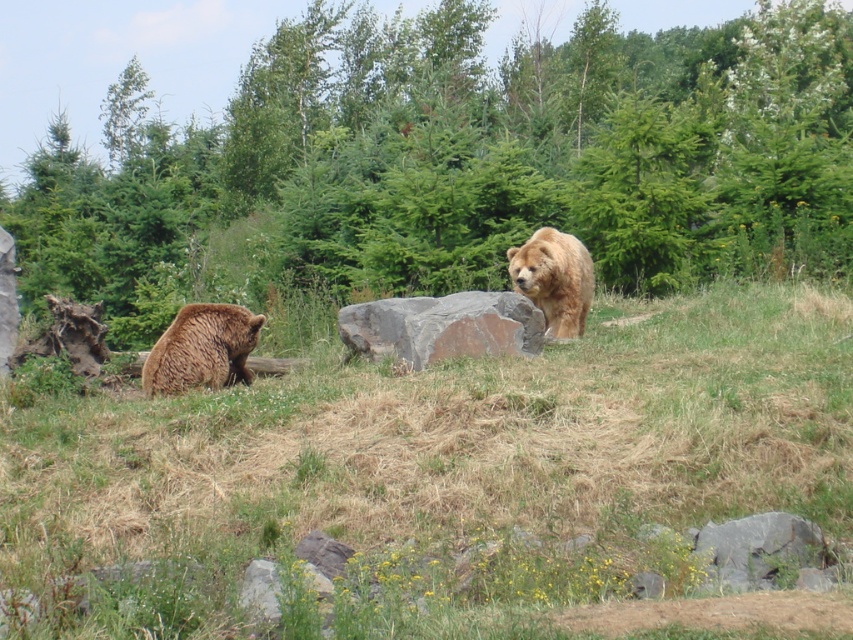
Question: Does brown furry grass at center have a greater width compared to fuzzy brown bear at left?

Choices:
 (A) yes
 (B) no

Answer: (A)

Question: In this image, where is green leafy tree at center located relative to fuzzy brown bear at left?

Choices:
 (A) right
 (B) left

Answer: (A)

Question: Which object appears farthest from the camera in this image?

Choices:
 (A) fuzzy brown bear at left
 (B) brown furry grass at center
 (C) green leafy tree at center
 (D) gray rough rock at center

Answer: (C)

Question: Which of the following is the closest to the observer?

Choices:
 (A) fuzzy brown bear at left
 (B) gray rough rock at center
 (C) brown furry grass at center
 (D) golden fur bear at center

Answer: (C)

Question: Which of the following is the closest to the observer?

Choices:
 (A) pyautogui.click(x=250, y=152)
 (B) pyautogui.click(x=456, y=400)
 (C) pyautogui.click(x=186, y=353)
 (D) pyautogui.click(x=352, y=320)

Answer: (B)

Question: Is green leafy tree at center in front of fuzzy brown bear at left?

Choices:
 (A) no
 (B) yes

Answer: (A)